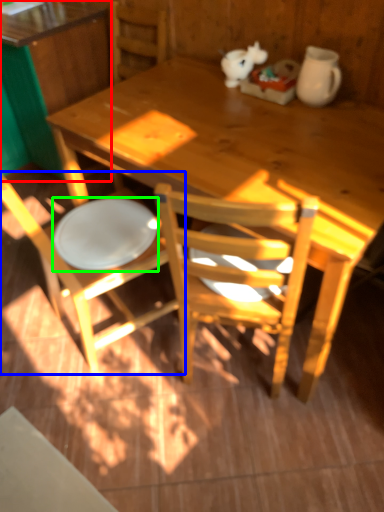
Question: Which object is positioned farthest from desk (highlighted by a red box)? Select from chair (highlighted by a blue box) and plate (highlighted by a green box).

Choices:
 (A) chair
 (B) plate

Answer: (A)